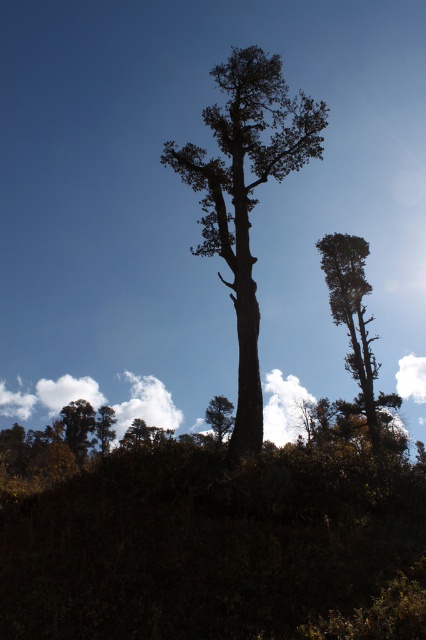
How much distance is there between dark brown wood tree at center and smooth brown tree at upper right?

dark brown wood tree at center and smooth brown tree at upper right are 47.07 feet apart.

Is dark brown wood tree at center to the left of smooth brown tree at upper right from the viewer's perspective?

Indeed, dark brown wood tree at center is positioned on the left side of smooth brown tree at upper right.

Locate an element on the screen. dark brown wood tree at center is located at coordinates coord(245,195).

Consider the image. Is green leafy tree at center smaller than green leafy tree at lower left?

Actually, green leafy tree at center might be larger than green leafy tree at lower left.

Is point (215, 403) closer to viewer compared to point (97, 424)?

Yes, point (215, 403) is in front of point (97, 424).

Find the location of `green leafy tree at center`. green leafy tree at center is located at coordinates (219, 416).

Between point (250, 305) and point (74, 426), which one is positioned in front?

Point (250, 305)

Does dark brown wood tree at center have a smaller size compared to green matte tree at lower left?

Incorrect, dark brown wood tree at center is not smaller in size than green matte tree at lower left.

Where is `dark brown wood tree at center`? dark brown wood tree at center is located at coordinates (245, 195).

Where is `dark brown wood tree at center`? This screenshot has height=640, width=426. dark brown wood tree at center is located at coordinates (245, 195).